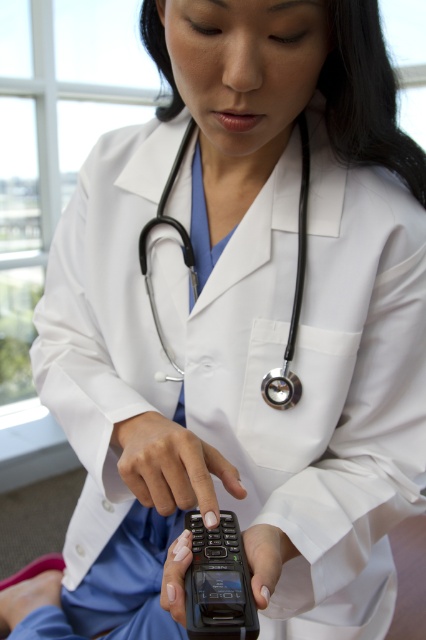
Question: Which object is farther from the camera taking this photo?

Choices:
 (A) black rubber stethoscope at center
 (B) black matte phone at center

Answer: (A)

Question: Does smooth skin hand at center have a larger size compared to black rubber stethoscope at center?

Choices:
 (A) no
 (B) yes

Answer: (A)

Question: Is smooth skin hand at center behind black matte phone at center?

Choices:
 (A) no
 (B) yes

Answer: (B)

Question: Which object is closer to the camera taking this photo?

Choices:
 (A) black matte phone at center
 (B) smooth skin hand at center

Answer: (A)

Question: Is smooth skin hand at center smaller than black rubber stethoscope at center?

Choices:
 (A) no
 (B) yes

Answer: (B)

Question: Estimate the real-world distances between objects in this image. Which object is farther from the smooth skin hand at center?

Choices:
 (A) black rubber stethoscope at center
 (B) black matte phone at center

Answer: (A)